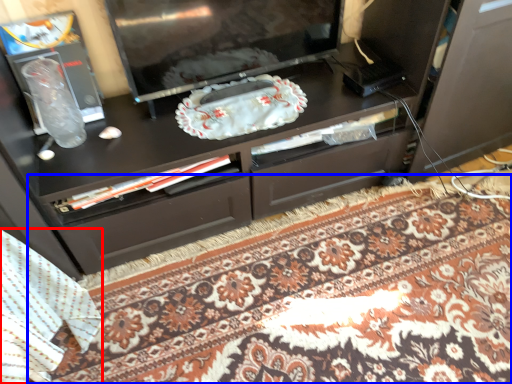
Question: Among these objects, which one is farthest to the camera, blanket (highlighted by a red box) or mat (highlighted by a blue box)?

Choices:
 (A) blanket
 (B) mat

Answer: (B)